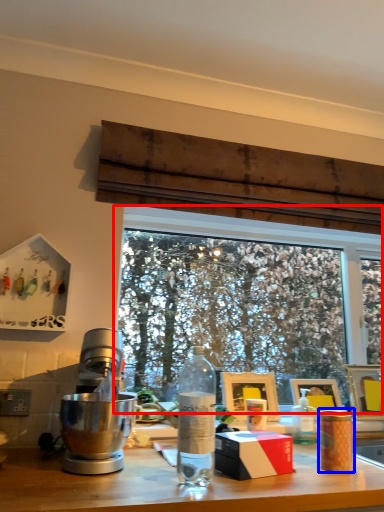
Question: Which point is closer to the camera, window (highlighted by a red box) or coffee cup (highlighted by a blue box)?

Choices:
 (A) window
 (B) coffee cup

Answer: (B)